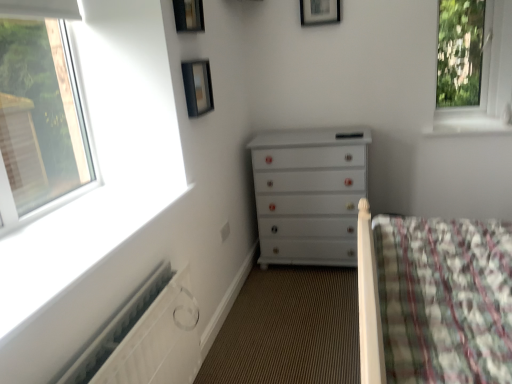
Locate an element on the screen. The image size is (512, 384). white textured radiator at lower left is located at coordinates (146, 338).

Measure the distance between point (154,341) and camera.

Point (154,341) is 1.46 meters from camera.

What is the approximate width of matte black picture frame at upper center, the first picture frame when ordered from bottom to top?

matte black picture frame at upper center, the first picture frame when ordered from bottom to top, is 2.54 inches in width.

What do you see at coordinates (319, 12) in the screenshot? I see `wooden picture frame at upper center, which is the first picture frame from top to bottom` at bounding box center [319, 12].

Identify the location of white textured radiator at lower left. (146, 338).

In the image, is matte black picture frame at upper center, the second picture frame in the right-to-left sequence, positioned in front of or behind transparent glass window at upper right?

matte black picture frame at upper center, the second picture frame in the right-to-left sequence, is in front of transparent glass window at upper right.

How many degrees apart are the facing directions of matte black picture frame at upper center, the 2th picture frame in the left-to-right sequence, and transparent glass window at upper right?

91.8 degrees.

Is matte black picture frame at upper center, the second picture frame in the right-to-left sequence, thinner than transparent glass window at upper right?

Yes.

Is matte black picture frame at upper center, which ranks as the third picture frame in top-to-bottom order, situated inside transparent glass window at upper right or outside?

matte black picture frame at upper center, which ranks as the third picture frame in top-to-bottom order, is not enclosed by transparent glass window at upper right.

Considering the sizes of objects white glossy chest of drawers at center and white glossy window sill at upper right in the image provided, who is taller, white glossy chest of drawers at center or white glossy window sill at upper right?

Standing taller between the two is white glossy chest of drawers at center.

Which is in front, white glossy chest of drawers at center or white glossy window sill at upper right?

white glossy chest of drawers at center is closer to the camera.

Can you confirm if white glossy chest of drawers at center is bigger than white glossy window sill at upper right?

Indeed, white glossy chest of drawers at center has a larger size compared to white glossy window sill at upper right.

From the image's perspective, is white glossy chest of drawers at center on top of white glossy window sill at upper right?

No, from the image's perspective, white glossy chest of drawers at center is not above white glossy window sill at upper right.

Considering the positions of objects wooden picture frame at upper center, arranged as the 1th picture frame when viewed from the right, and black glass picture frame at upper center, the first picture frame viewed from the left, in the image provided, who is more to the left, wooden picture frame at upper center, arranged as the 1th picture frame when viewed from the right, or black glass picture frame at upper center, the first picture frame viewed from the left,?

From the viewer's perspective, black glass picture frame at upper center, the first picture frame viewed from the left, appears more on the left side.

From the image's perspective, is wooden picture frame at upper center, which is counted as the 1th picture frame, starting from the back, located beneath black glass picture frame at upper center, marked as the third picture frame in a back-to-front arrangement?

No.

Is wooden picture frame at upper center, the 3th picture frame in the bottom-to-top sequence, completely or partially outside of black glass picture frame at upper center, marked as the third picture frame in a back-to-front arrangement?

Yes, wooden picture frame at upper center, the 3th picture frame in the bottom-to-top sequence, is outside of black glass picture frame at upper center, marked as the third picture frame in a back-to-front arrangement.

Is wooden picture frame at upper center, arranged as the 1th picture frame when viewed from the right, wider than black glass picture frame at upper center, positioned as the second picture frame in bottom-to-top order?

In fact, wooden picture frame at upper center, arranged as the 1th picture frame when viewed from the right, might be narrower than black glass picture frame at upper center, positioned as the second picture frame in bottom-to-top order.

Are white glossy chest of drawers at center and matte black picture frame at upper center, the 2th picture frame in the left-to-right sequence, making contact?

white glossy chest of drawers at center is not next to matte black picture frame at upper center, the 2th picture frame in the left-to-right sequence, and they're not touching.

How many degrees apart are the facing directions of white glossy chest of drawers at center and matte black picture frame at upper center, the second picture frame in the right-to-left sequence?

They differ by 90.6 degrees in their facing directions.

From a real-world perspective, between white glossy chest of drawers at center and matte black picture frame at upper center, arranged as the second picture frame when viewed from the front, who is vertically higher?

matte black picture frame at upper center, arranged as the second picture frame when viewed from the front, is physically above.

Is point (335, 129) farther from camera compared to point (191, 96)?

That is True.

Is transparent glass window at upper right looking in the opposite direction of black glass picture frame at upper center, marked as the second picture frame in a top-to-bottom arrangement?

No, transparent glass window at upper right is not facing the opposite direction of black glass picture frame at upper center, marked as the second picture frame in a top-to-bottom arrangement.

From the image's perspective, is transparent glass window at upper right above or below black glass picture frame at upper center, marked as the 3th picture frame in a right-to-left arrangement?

Clearly, from the image's perspective, transparent glass window at upper right is above black glass picture frame at upper center, marked as the 3th picture frame in a right-to-left arrangement.

How distant is transparent glass window at upper right from black glass picture frame at upper center, marked as the 3th picture frame in a right-to-left arrangement?

transparent glass window at upper right and black glass picture frame at upper center, marked as the 3th picture frame in a right-to-left arrangement, are 1.96 meters apart.

Does transparent glass window at upper right have a smaller size compared to black glass picture frame at upper center, which ranks as the 1th picture frame in front-to-back order?

No, transparent glass window at upper right is not smaller than black glass picture frame at upper center, which ranks as the 1th picture frame in front-to-back order.

From the image's perspective, is white glossy window sill at upper right above white glossy chest of drawers at center?

Yes, from the image's perspective, white glossy window sill at upper right is on top of white glossy chest of drawers at center.

Between point (453, 118) and point (290, 225), which one is positioned behind?

Point (453, 118)

Which object is wider, white glossy window sill at upper right or white glossy chest of drawers at center?

Wider between the two is white glossy window sill at upper right.

From a real-world perspective, is white glossy window sill at upper right positioned above or below white glossy chest of drawers at center?

white glossy window sill at upper right is situated higher than white glossy chest of drawers at center in the real world.

Considering the relative sizes of wooden picture frame at upper center, placed as the third picture frame when sorted from front to back, and white glossy window sill at upper right in the image provided, is wooden picture frame at upper center, placed as the third picture frame when sorted from front to back, shorter than white glossy window sill at upper right?

No.

In terms of size, does wooden picture frame at upper center, which is counted as the 1th picture frame, starting from the back, appear bigger or smaller than white glossy window sill at upper right?

Clearly, wooden picture frame at upper center, which is counted as the 1th picture frame, starting from the back, is smaller in size than white glossy window sill at upper right.

What's the angular difference between wooden picture frame at upper center, which is the first picture frame from top to bottom, and white glossy window sill at upper right's facing directions?

wooden picture frame at upper center, which is the first picture frame from top to bottom, and white glossy window sill at upper right are facing 0.455 degrees away from each other.

From the transparent glass window at upper right, count the 2nd picture frame to the left and point to it. Please provide its 2D coordinates.

[(197, 87)]

Identify the location of the chest of drawers below the white glossy window sill at upper right (from a real-world perspective). (309, 194).

From the image, which object appears to be farther from black glass picture frame at upper center, marked as the second picture frame in a top-to-bottom arrangement, matte black picture frame at upper center, the second picture frame positioned from the back, or white glossy window sill at upper right?

white glossy window sill at upper right.

Based on the photo, considering their positions, is white glossy chest of drawers at center positioned further to wooden picture frame at upper center, which is counted as the 1th picture frame, starting from the back, than matte black picture frame at upper center, the second picture frame in the right-to-left sequence?

white glossy chest of drawers at center lies further to wooden picture frame at upper center, which is counted as the 1th picture frame, starting from the back, than the other object.

Looking at the image, which one is located further to black glass picture frame at upper center, which ranks as the 1th picture frame in front-to-back order, white textured radiator at lower left or white glossy chest of drawers at center?

white textured radiator at lower left lies further to black glass picture frame at upper center, which ranks as the 1th picture frame in front-to-back order, than the other object.

Based on their spatial positions, is black glass picture frame at upper center, positioned as the second picture frame in bottom-to-top order, or white textured radiator at lower left further from white glossy chest of drawers at center?

white textured radiator at lower left.

Based on their spatial positions, is black glass picture frame at upper center, marked as the second picture frame in a top-to-bottom arrangement, or white glossy chest of drawers at center closer to wooden picture frame at upper center, which is the first picture frame from top to bottom?

black glass picture frame at upper center, marked as the second picture frame in a top-to-bottom arrangement, lies closer to wooden picture frame at upper center, which is the first picture frame from top to bottom, than the other object.

Looking at the image, which one is located closer to white glossy window sill at upper right, matte black picture frame at upper center, the 2th picture frame in the left-to-right sequence, or transparent glass window at upper right?

Among the two, transparent glass window at upper right is located nearer to white glossy window sill at upper right.

Which object lies further to the anchor point white textured radiator at lower left, white glossy chest of drawers at center or white glossy window sill at upper right?

Among the two, white glossy window sill at upper right is located further to white textured radiator at lower left.

Looking at the image, which one is located closer to black glass picture frame at upper center, marked as the second picture frame in a top-to-bottom arrangement, wooden picture frame at upper center, which is counted as the 1th picture frame, starting from the back, or white glossy chest of drawers at center?

Based on the image, wooden picture frame at upper center, which is counted as the 1th picture frame, starting from the back, appears to be nearer to black glass picture frame at upper center, marked as the second picture frame in a top-to-bottom arrangement.

The width and height of the screenshot is (512, 384). Identify the location of chest of drawers between white textured radiator at lower left and transparent glass window at upper right. (309, 194).

Locate an element on the screen. The width and height of the screenshot is (512, 384). the chest of drawers located between matte black picture frame at upper center, the second picture frame positioned from the back, and white glossy window sill at upper right in the left-right direction is located at coordinates (309, 194).

Where is `window sill between wooden picture frame at upper center, placed as the third picture frame when sorted from front to back, and white glossy chest of drawers at center, in the vertical direction`? Image resolution: width=512 pixels, height=384 pixels. window sill between wooden picture frame at upper center, placed as the third picture frame when sorted from front to back, and white glossy chest of drawers at center, in the vertical direction is located at coordinates (466, 126).

The height and width of the screenshot is (384, 512). What are the coordinates of `window sill between white glossy chest of drawers at center and transparent glass window at upper right` in the screenshot? It's located at (466, 126).